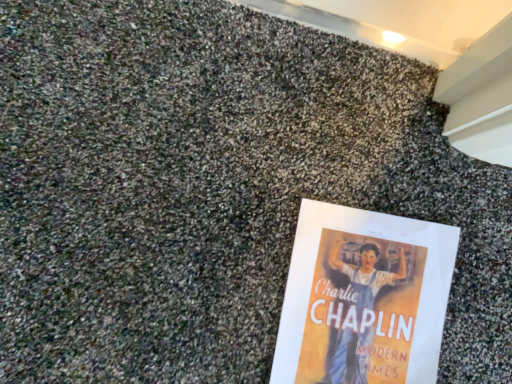
What do you see at coordinates (364, 298) in the screenshot?
I see `matte paper poster at lower right` at bounding box center [364, 298].

In order to face matte paper poster at lower right, should I rotate leftwards or rightwards?

Rotate your view right by about 13.589°.

Measure the distance between matte paper poster at lower right and camera.

They are 21.85 inches apart.

Find the location of `matte paper poster at lower right`. matte paper poster at lower right is located at coordinates (364, 298).

Identify the location of matte paper poster at lower right. Image resolution: width=512 pixels, height=384 pixels. click(364, 298).